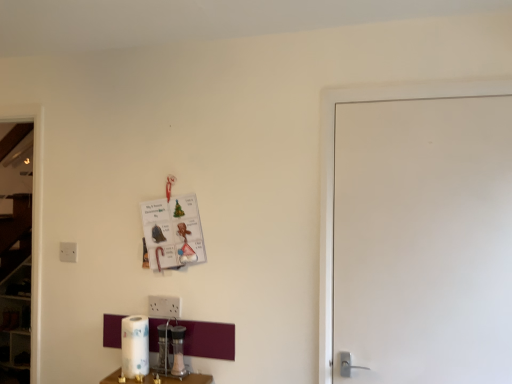
Question: In terms of height, does white glossy paper towel at lower center look taller or shorter compared to white plastic electric outlet at left?

Choices:
 (A) tall
 (B) short

Answer: (A)

Question: Considering their positions, is white glossy paper towel at lower center located in front of or behind white plastic electric outlet at left?

Choices:
 (A) front
 (B) behind

Answer: (A)

Question: Considering the real-world distances, which object is farthest from the white matte door at right?

Choices:
 (A) white plastic electric outlet at left
 (B) metallic silver salt shaker at lower center
 (C) white glossy paper towel at lower center

Answer: (A)

Question: Which is farther from the metallic silver salt shaker at lower center?

Choices:
 (A) white glossy paper towel at lower center
 (B) white plastic electric outlet at left
 (C) white matte door at right

Answer: (C)